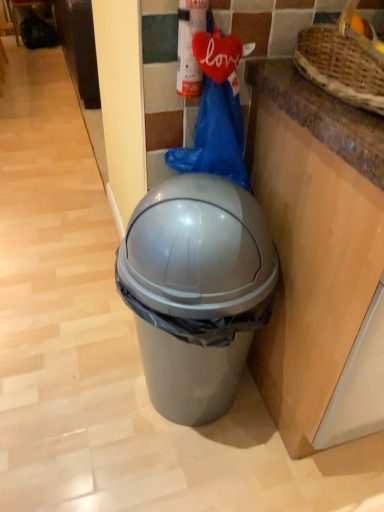
Question: From the image's perspective, does metallic silver extinguisher at upper center appear lower than brown woven basket at upper right?

Choices:
 (A) no
 (B) yes

Answer: (A)

Question: Does metallic silver extinguisher at upper center have a lesser height compared to brown woven basket at upper right?

Choices:
 (A) no
 (B) yes

Answer: (A)

Question: Is brown woven basket at upper right at the back of metallic silver extinguisher at upper center?

Choices:
 (A) no
 (B) yes

Answer: (A)

Question: Is metallic silver extinguisher at upper center closer to camera compared to brown woven basket at upper right?

Choices:
 (A) no
 (B) yes

Answer: (A)

Question: Is metallic silver extinguisher at upper center surrounding brown woven basket at upper right?

Choices:
 (A) yes
 (B) no

Answer: (B)

Question: From a real-world perspective, is metallic silver extinguisher at upper center below brown woven basket at upper right?

Choices:
 (A) no
 (B) yes

Answer: (B)

Question: Is brown woven basket at upper right oriented towards metallic silver extinguisher at upper center?

Choices:
 (A) no
 (B) yes

Answer: (A)

Question: Is brown woven basket at upper right completely or partially outside of metallic silver extinguisher at upper center?

Choices:
 (A) yes
 (B) no

Answer: (A)

Question: From the image's perspective, would you say brown woven basket at upper right is shown under metallic silver extinguisher at upper center?

Choices:
 (A) no
 (B) yes

Answer: (B)

Question: From the image's perspective, does brown woven basket at upper right appear higher than metallic silver extinguisher at upper center?

Choices:
 (A) yes
 (B) no

Answer: (B)

Question: From a real-world perspective, is brown woven basket at upper right on metallic silver extinguisher at upper center?

Choices:
 (A) yes
 (B) no

Answer: (A)

Question: Can you confirm if brown woven basket at upper right is shorter than metallic silver extinguisher at upper center?

Choices:
 (A) no
 (B) yes

Answer: (B)

Question: Is matte gray trash can at center far from brown woven basket at upper right?

Choices:
 (A) no
 (B) yes

Answer: (A)